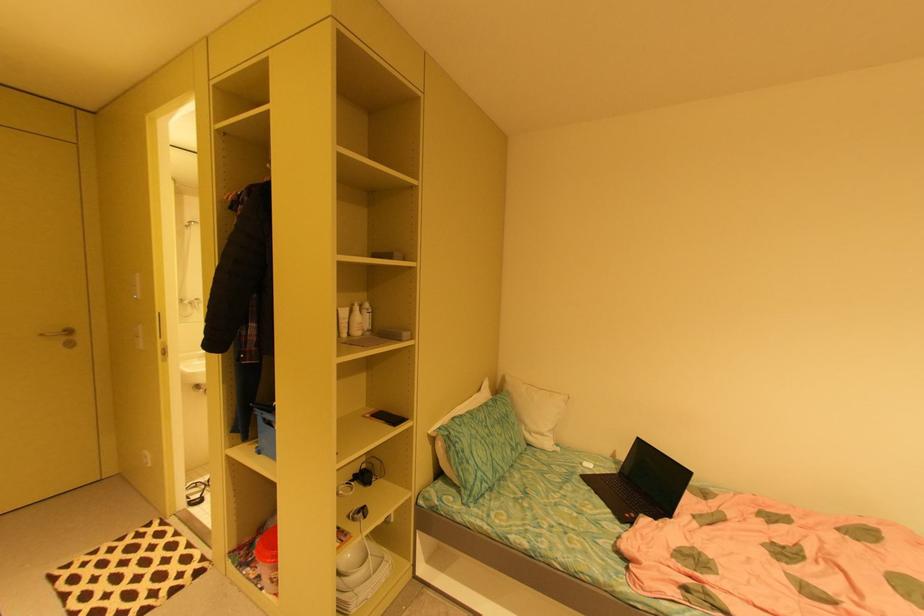
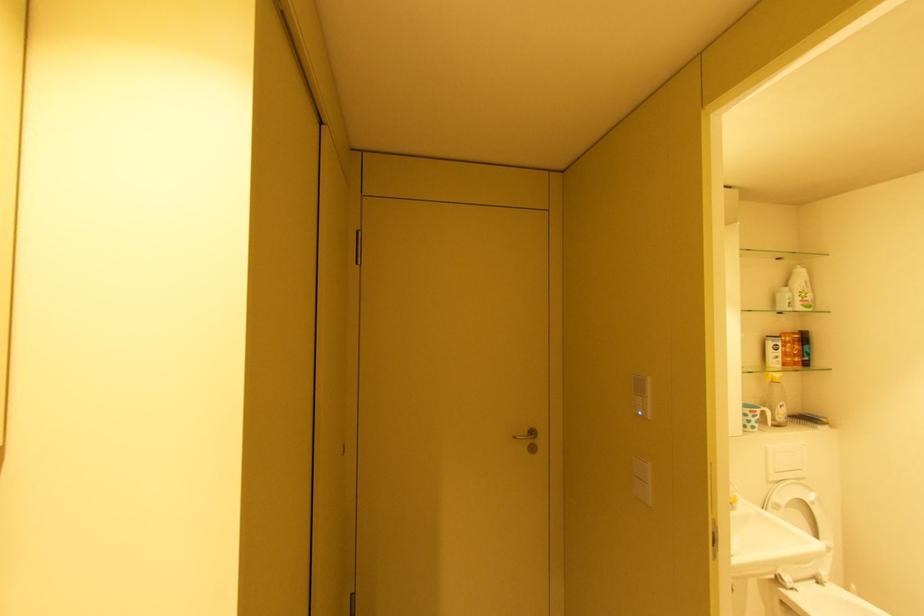
Where in the second image is the point corresponding to (x=49, y=334) from the first image?

(520, 438)